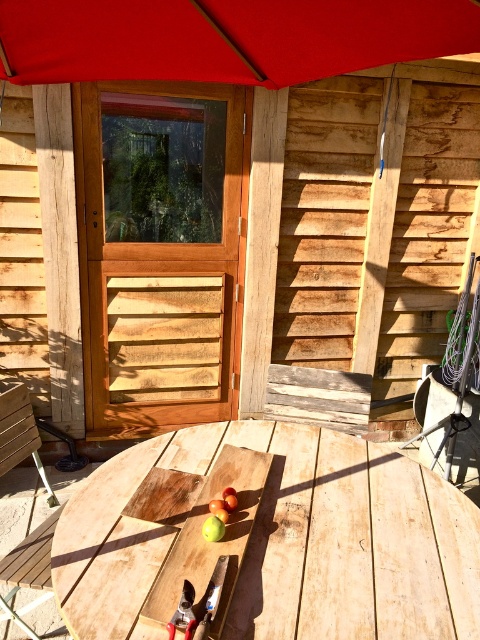
You are planning to sit under the red fabric umbrella at upper center. To reach it from the wooden bench at lower left, which direction should you move?

You should move to the right to reach the red fabric umbrella at upper center from the wooden bench at lower left since it is located to the right of the bench.